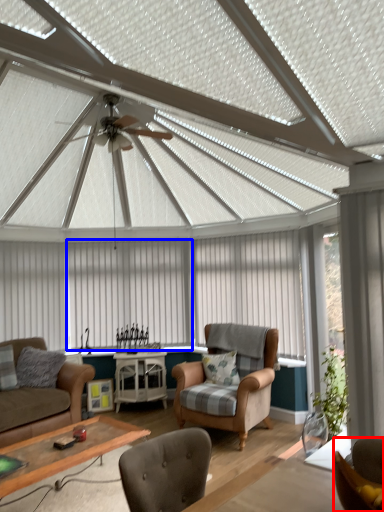
Question: Which object is further to the camera taking this photo, chair (highlighted by a red box) or curtain (highlighted by a blue box)?

Choices:
 (A) chair
 (B) curtain

Answer: (B)